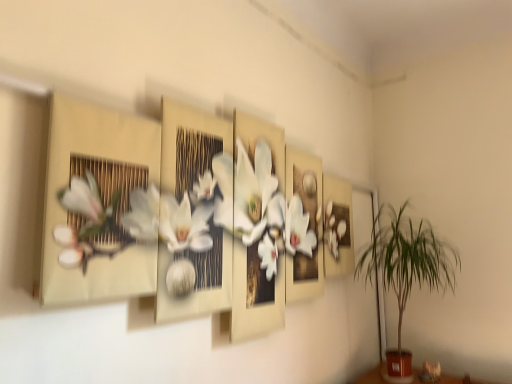
The height and width of the screenshot is (384, 512). Describe the element at coordinates (406, 270) in the screenshot. I see `green leafy plant at right` at that location.

You are a GUI agent. You are given a task and a screenshot of the screen. Output one action in this format:
    pyautogui.click(x=<x>, y=<y>)
    Task: Click on the green leafy plant at right
    This screenshot has height=384, width=512.
    Given the screenshot: What is the action you would take?
    406,270

Locate an element on the screen. The image size is (512, 384). green leafy plant at right is located at coordinates pos(406,270).